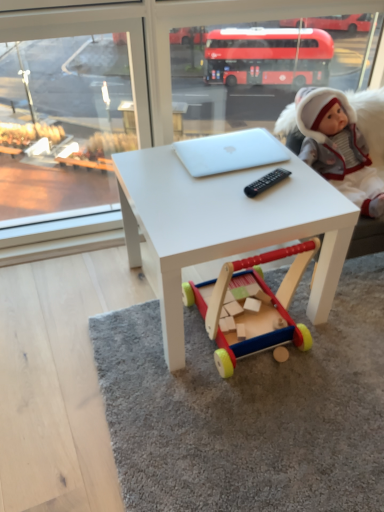
Question: Should I look upward or downward to see white matte table at center?

Choices:
 (A) up
 (B) down

Answer: (A)

Question: From the image's perspective, is white plush doll at upper right under wooden toy at center?

Choices:
 (A) no
 (B) yes

Answer: (A)

Question: Is white plush doll at upper right to the left of wooden toy at center from the viewer's perspective?

Choices:
 (A) yes
 (B) no

Answer: (B)

Question: From a real-world perspective, is white plush doll at upper right located higher than wooden toy at center?

Choices:
 (A) no
 (B) yes

Answer: (B)

Question: Is white plush doll at upper right thinner than wooden toy at center?

Choices:
 (A) yes
 (B) no

Answer: (A)

Question: Considering the relative sizes of white plush doll at upper right and wooden toy at center in the image provided, is white plush doll at upper right bigger than wooden toy at center?

Choices:
 (A) yes
 (B) no

Answer: (B)

Question: From a real-world perspective, is white plush doll at upper right beneath wooden toy at center?

Choices:
 (A) yes
 (B) no

Answer: (B)

Question: Is wooden toy at center located within white matte table at center?

Choices:
 (A) no
 (B) yes

Answer: (B)

Question: Is white matte table at center taller than wooden toy at center?

Choices:
 (A) no
 (B) yes

Answer: (B)

Question: From a real-world perspective, is white matte table at center beneath wooden toy at center?

Choices:
 (A) no
 (B) yes

Answer: (A)

Question: From the image's perspective, is white matte table at center above wooden toy at center?

Choices:
 (A) no
 (B) yes

Answer: (B)

Question: Are white matte table at center and wooden toy at center making contact?

Choices:
 (A) no
 (B) yes

Answer: (A)

Question: Is white matte table at center positioned beyond the bounds of wooden toy at center?

Choices:
 (A) yes
 (B) no

Answer: (A)

Question: Is white matte laptop at center positioned behind white plush doll at upper right?

Choices:
 (A) no
 (B) yes

Answer: (B)